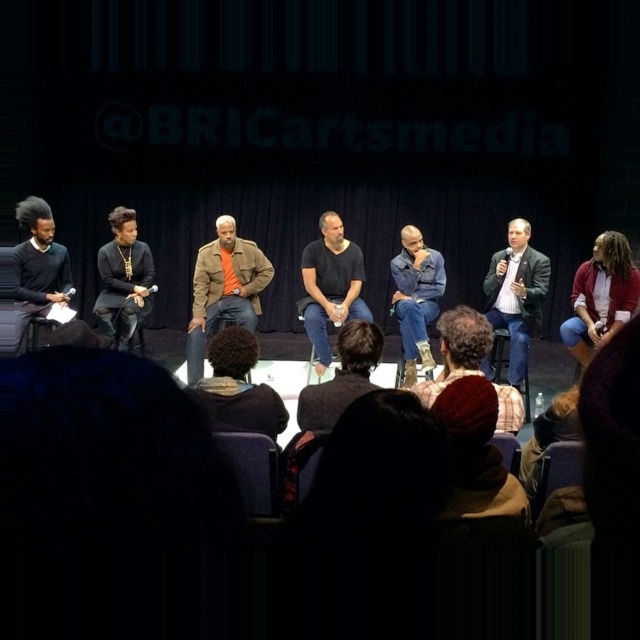
Can you confirm if denim jacket at lower right is positioned to the left of black cotton shirt at center?

In fact, denim jacket at lower right is to the right of black cotton shirt at center.

Is denim jacket at lower right to the right of black cotton shirt at center from the viewer's perspective?

Yes, denim jacket at lower right is to the right of black cotton shirt at center.

Which is in front, point (595, 305) or point (323, 227)?

Point (595, 305) is more forward.

This screenshot has height=640, width=640. What are the coordinates of `denim jacket at lower right` in the screenshot? It's located at (600, 296).

Who is positioned more to the right, knitted red hat at lower center or dark gray suit at right?

dark gray suit at right is more to the right.

The image size is (640, 640). What do you see at coordinates (476, 452) in the screenshot? I see `knitted red hat at lower center` at bounding box center [476, 452].

Locate an element on the screen. This screenshot has height=640, width=640. knitted red hat at lower center is located at coordinates 476,452.

Is dark brown hair at lower center wider than dark gray suit at right?

Incorrect, dark brown hair at lower center's width does not surpass dark gray suit at right's.

Does point (212, 387) come closer to viewer compared to point (508, 371)?

That is True.

Find the location of a particular element. This screenshot has width=640, height=640. dark brown hair at lower center is located at coordinates (237, 387).